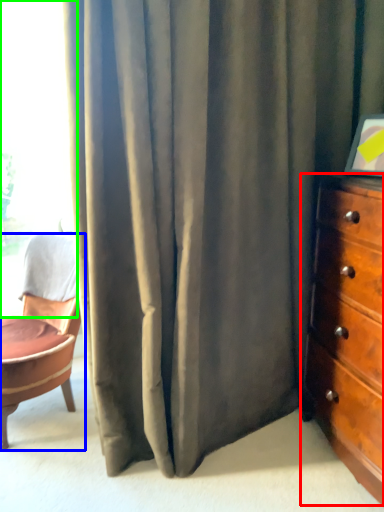
Question: Which object is positioned farthest from chest of drawers (highlighted by a red box)? Select from chair (highlighted by a blue box) and window (highlighted by a green box).

Choices:
 (A) chair
 (B) window

Answer: (B)